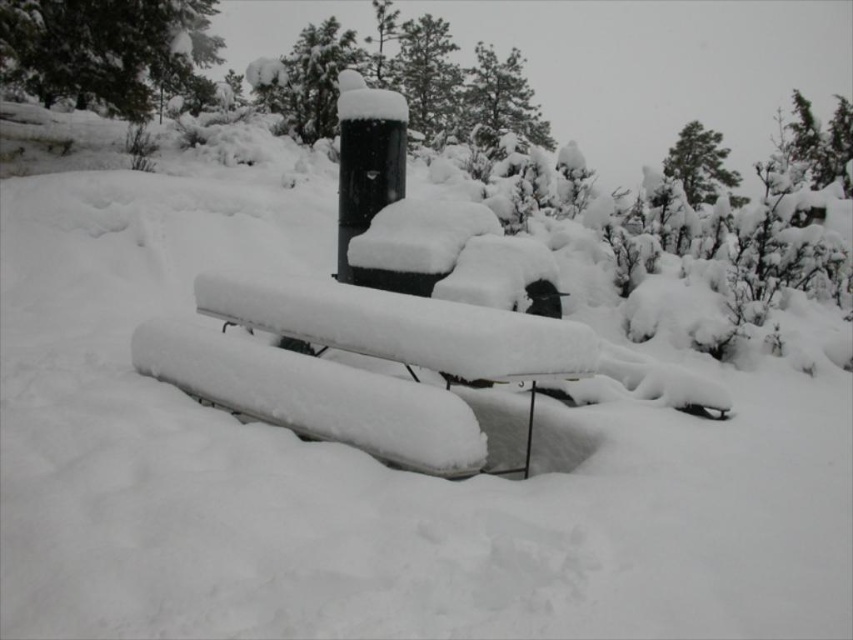
You are an observer looking at the winter scene. You notice two green textured trees in the background. Which one is closer to you, the green textured pine at upper left or the green textured tree at upper right?

The green textured pine at upper left is closer to you because it is in front of the green textured tree at upper right.